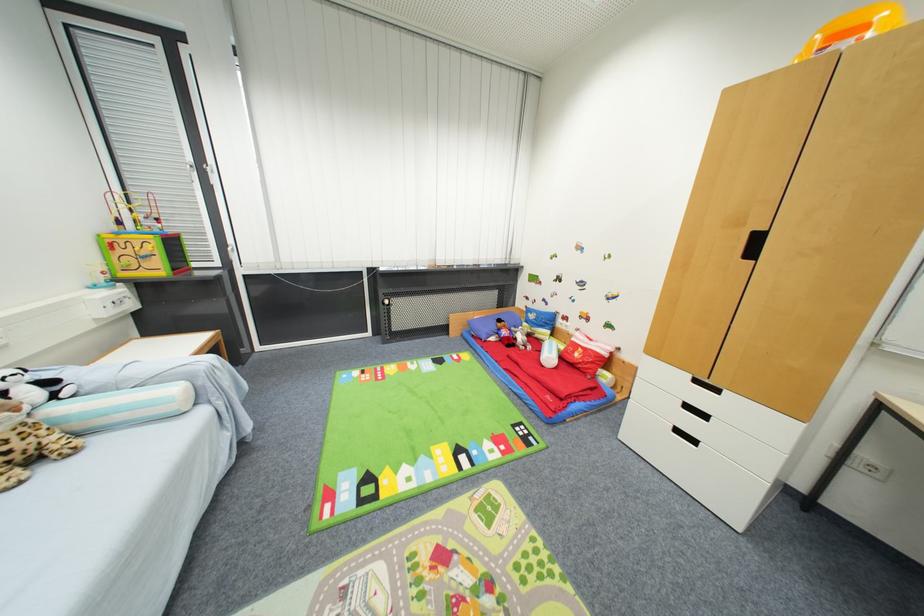
What do you see at coordinates (410, 434) in the screenshot? The height and width of the screenshot is (616, 924). I see `the colorful activity cube` at bounding box center [410, 434].